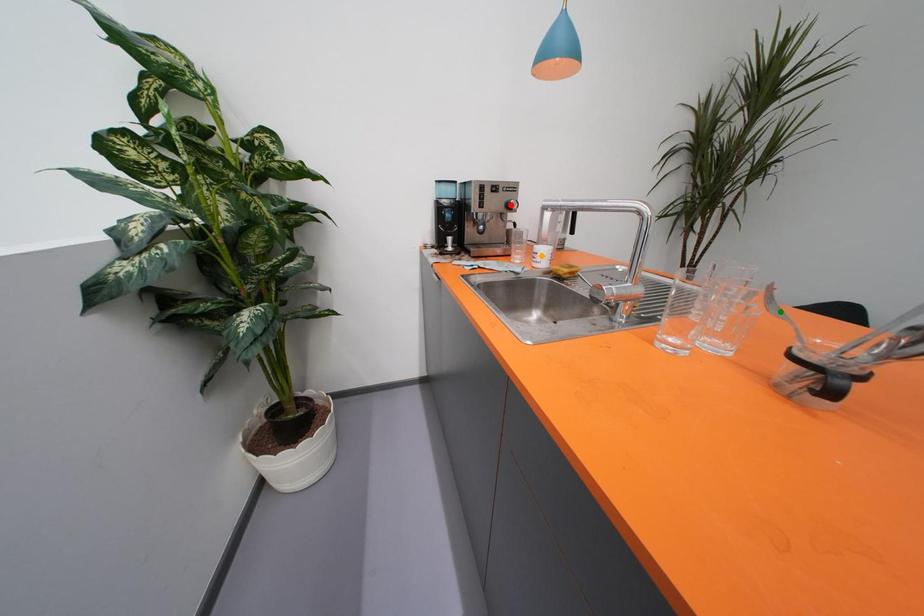
Order these from nearest to farthest:
A) orange point
B) green point
C) red point

1. red point
2. orange point
3. green point